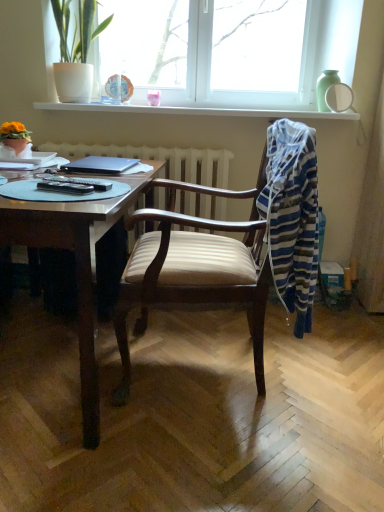
Locate an element on the screen. This screenshot has height=512, width=384. unoccupied region to the right of matte orange flower pot at left, positioned as the first houseplant in front-to-back order is located at coordinates (46, 158).